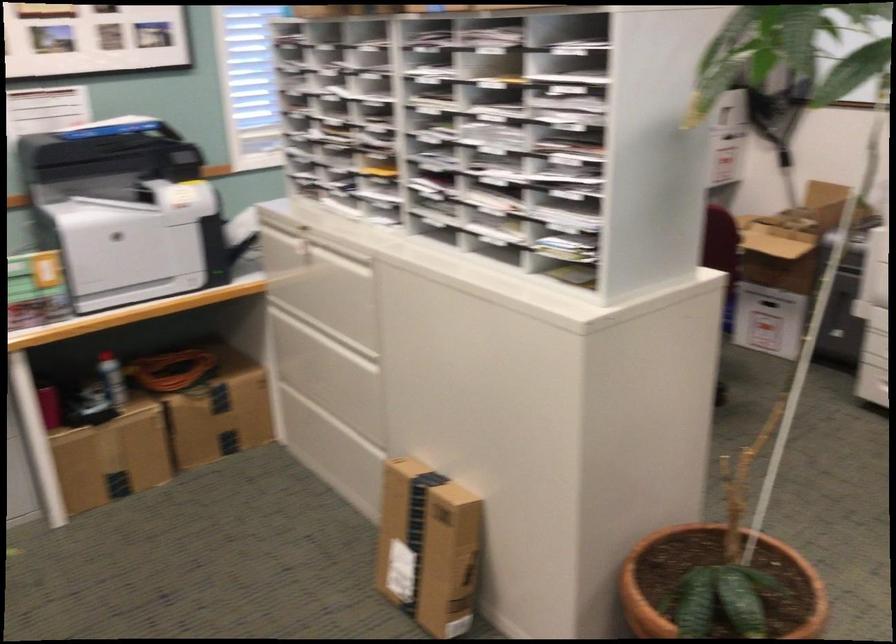
What do you see at coordinates (718, 582) in the screenshot? This screenshot has height=644, width=896. I see `a terracotta plant pot` at bounding box center [718, 582].